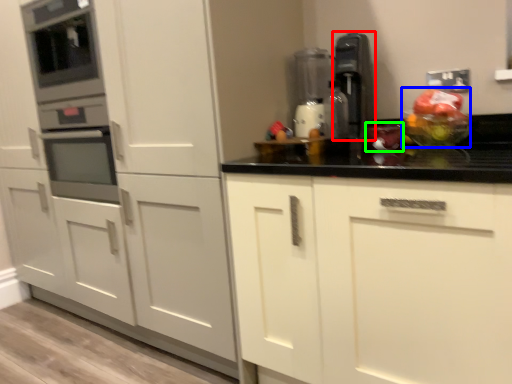
Question: Which object is the closest to the kitchen appliance (highlighted by a red box)? Choose among these: fruit salad (highlighted by a blue box) or food (highlighted by a green box).

Choices:
 (A) fruit salad
 (B) food

Answer: (B)